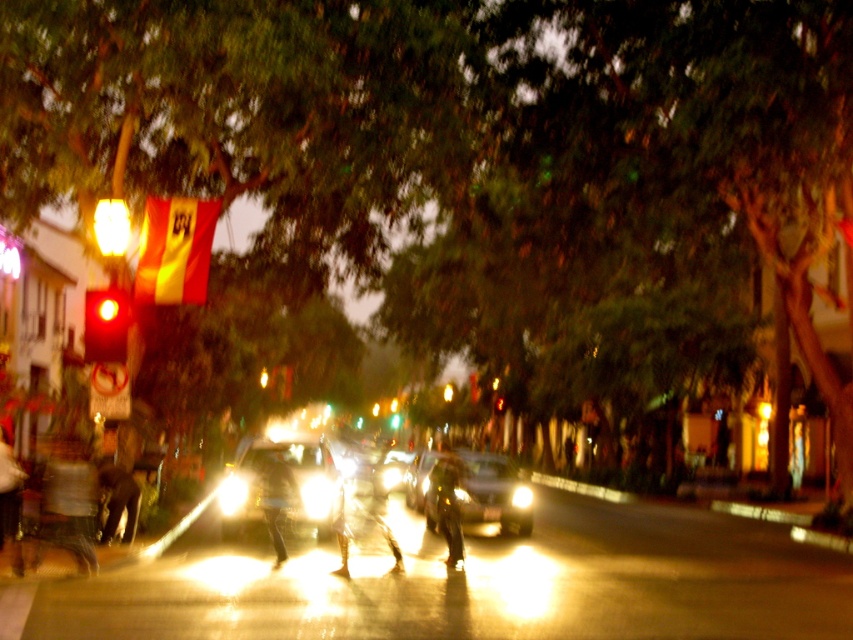
You are a delivery robot with a 3.5 feet wide package. You need to move from the left side of the street to the right side. The metallic gold person at center and the metallic silver pants at center are in your path. Can you navigate between them without moving the objects?

The distance between the metallic gold person at center and the metallic silver pants at center is 9.63 feet. Since your package is 3.5 feet wide, there is enough space to navigate between them safely.

You are a pedestrian standing on the sidewalk and want to cross the street. You see a shiny silver car at center and a green glass traffic light at center. Which object is closer to you?

The shiny silver car at center is positioned over the green glass traffic light at center, so the shiny silver car at center is closer to you.

You are a pedestrian trying to cross the street at night. You see the metallic reflective pants at center. Based on their position, can you estimate whether they are closer to you or further away compared to the buildings with lit windows on the left side?

The metallic reflective pants at center is located at point (x=361, y=506), which is closer to the viewer than the buildings with lit windows on the left side, so the metallic reflective pants at center are closer to you.